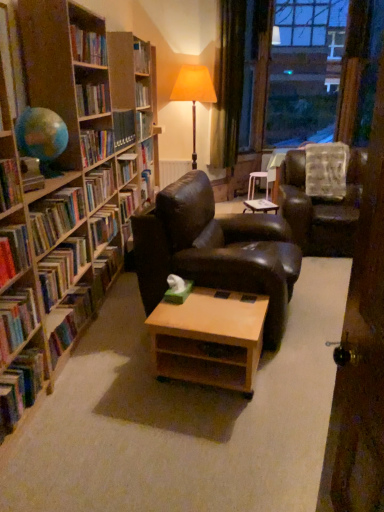
You are a GUI agent. You are given a task and a screenshot of the screen. Output one action in this format:
    pyautogui.click(x=<x>, y=<y>)
    Task: Click on the light brown wood coffee table at center
    This screenshot has height=512, width=384.
    Given the screenshot: What is the action you would take?
    pyautogui.click(x=209, y=339)

You are a GUI agent. You are given a task and a screenshot of the screen. Output one action in this format:
    pyautogui.click(x=<x>, y=<y>)
    Task: Click on the hardcover books at left, which appears as the third book when viewed from the top
    The width and height of the screenshot is (384, 512).
    Given the screenshot: What is the action you would take?
    pyautogui.click(x=55, y=217)

What do you see at coordinates (304, 71) in the screenshot?
I see `transparent glass window at upper right` at bounding box center [304, 71].

Locate an element on the screen. This screenshot has width=384, height=512. transparent glass window at upper right is located at coordinates (304, 71).

Identify the location of hardcover book at left, the seventh book positioned from the top. (69, 320).

Describe the element at coordinates (260, 205) in the screenshot. The height and width of the screenshot is (512, 384). I see `wooden table at center` at that location.

Measure the distance between point (374, 304) and camera.

A distance of 3.59 feet exists between point (374, 304) and camera.

The height and width of the screenshot is (512, 384). What are the coordinates of `light brown wood coffee table at center` in the screenshot? It's located at (209, 339).

In order to click on table lamp above the hardcover book at left, the fourth book positioned from the top (from a real-world perspective) in this screenshot , I will do `click(194, 94)`.

Considering the relative sizes of orange fabric lampshade at center and hardcover book at left, the fifth book when ordered from bottom to top, in the image provided, is orange fabric lampshade at center thinner than hardcover book at left, the fifth book when ordered from bottom to top,?

In fact, orange fabric lampshade at center might be wider than hardcover book at left, the fifth book when ordered from bottom to top.

Considering the relative positions of hardcover book at left, which is counted as the sixth book, starting from the top, and wooden door at right in the image provided, is hardcover book at left, which is counted as the sixth book, starting from the top, to the left of wooden door at right from the viewer's perspective?

Correct, you'll find hardcover book at left, which is counted as the sixth book, starting from the top, to the left of wooden door at right.

From a real-world perspective, is hardcover book at left, arranged as the third book when ordered from the bottom, above or below wooden door at right?

hardcover book at left, arranged as the third book when ordered from the bottom, is below wooden door at right.

Is hardcover book at left, arranged as the third book when ordered from the bottom, further to camera compared to wooden door at right?

Yes, it is behind wooden door at right.

Is hardcover book at left, arranged as the third book when ordered from the bottom, facing towards wooden door at right?

Yes, hardcover book at left, arranged as the third book when ordered from the bottom, is oriented towards wooden door at right.

Looking at this image, can we say hardcover book at left, the seventh book positioned from the top, lies outside wooden bookshelf at left, the 1th book when ordered from top to bottom?

Actually, hardcover book at left, the seventh book positioned from the top, is at least partially inside wooden bookshelf at left, the 1th book when ordered from top to bottom.

Considering their positions, is hardcover book at left, which is the 2th book in bottom-to-top order, located in front of or behind wooden bookshelf at left, the 1th book when ordered from top to bottom?

Clearly, hardcover book at left, which is the 2th book in bottom-to-top order, is behind wooden bookshelf at left, the 1th book when ordered from top to bottom.

From a real-world perspective, which object stands above the other?

wooden bookshelf at left, the 1th book when ordered from top to bottom, is physically above.

How far apart are hardcover book at left, which is the 2th book in bottom-to-top order, and wooden bookshelf at left, the eighth book when ordered from bottom to top?

hardcover book at left, which is the 2th book in bottom-to-top order, and wooden bookshelf at left, the eighth book when ordered from bottom to top, are 22.26 inches apart from each other.

Is hardcover books at left, the sixth book when ordered from bottom to top, in front of or behind light brown wood coffee table at center in the image?

hardcover books at left, the sixth book when ordered from bottom to top, is in front of light brown wood coffee table at center.

Considering the sizes of objects hardcover books at left, the sixth book when ordered from bottom to top, and light brown wood coffee table at center in the image provided, who is wider, hardcover books at left, the sixth book when ordered from bottom to top, or light brown wood coffee table at center?

Wider between the two is light brown wood coffee table at center.

From a real-world perspective, is hardcover books at left, which appears as the third book when viewed from the top, positioned under light brown wood coffee table at center based on gravity?

No, from a real-world perspective, hardcover books at left, which appears as the third book when viewed from the top, is not below light brown wood coffee table at center.

From a real-world perspective, count 5th books upward from the light brown wood coffee table at center and point to it. Please provide its 2D coordinates.

[(55, 217)]

From the image's perspective, which one is positioned higher, hardcover books at left, which appears as the third book when viewed from the top, or wooden table at center?

wooden table at center, from the image's perspective.

Which of these two, hardcover books at left, which appears as the third book when viewed from the top, or wooden table at center, is smaller?

wooden table at center.

Relative to wooden table at center, is hardcover books at left, the sixth book when ordered from bottom to top, in front or behind?

hardcover books at left, the sixth book when ordered from bottom to top, is positioned closer to the viewer than wooden table at center.

Considering the relative sizes of hardcover books at left, the sixth book when ordered from bottom to top, and wooden table at center in the image provided, is hardcover books at left, the sixth book when ordered from bottom to top, wider than wooden table at center?

No, hardcover books at left, the sixth book when ordered from bottom to top, is not wider than wooden table at center.

In the scene shown: Which point is more distant from viewer, (186, 92) or (252, 185)?

The point (252, 185) is farther from the camera.

From a real-world perspective, does orange fabric lampshade at center stand above white plastic stool at center?

Correct, in the physical world, orange fabric lampshade at center is higher than white plastic stool at center.

Is there a large distance between orange fabric lampshade at center and white plastic stool at center?

Yes, orange fabric lampshade at center and white plastic stool at center are located far from each other.

From the image's perspective, which one is positioned lower, orange fabric lampshade at center or white plastic stool at center?

white plastic stool at center appears lower in the image.

Is hardcover books at left, the sixth book when ordered from bottom to top, a part of hardcover books at left, marked as the 4th book in a bottom-to-top arrangement?

No, hardcover books at left, marked as the 4th book in a bottom-to-top arrangement, does not contain hardcover books at left, the sixth book when ordered from bottom to top.

From the picture: Considering the sizes of hardcover books at left, marked as the 4th book in a bottom-to-top arrangement, and hardcover books at left, the sixth book when ordered from bottom to top, in the image, is hardcover books at left, marked as the 4th book in a bottom-to-top arrangement, taller or shorter than hardcover books at left, the sixth book when ordered from bottom to top,?

In the image, hardcover books at left, marked as the 4th book in a bottom-to-top arrangement, appears to be taller than hardcover books at left, the sixth book when ordered from bottom to top.

From the image's perspective, is hardcover books at left, marked as the 5th book in a top-to-bottom arrangement, positioned above or below hardcover books at left, the sixth book when ordered from bottom to top?

Clearly, from the image's perspective, hardcover books at left, marked as the 5th book in a top-to-bottom arrangement, is below hardcover books at left, the sixth book when ordered from bottom to top.

Is hardcover books at left, marked as the 4th book in a bottom-to-top arrangement, bigger or smaller than hardcover books at left, the sixth book when ordered from bottom to top?

Clearly, hardcover books at left, marked as the 4th book in a bottom-to-top arrangement, is larger in size than hardcover books at left, the sixth book when ordered from bottom to top.

Image resolution: width=384 pixels, height=512 pixels. Find the location of `table lamp behind the hardcover book at left, the fifth book when ordered from bottom to top`. table lamp behind the hardcover book at left, the fifth book when ordered from bottom to top is located at coordinates (194, 94).

Locate an element on the screen. The image size is (384, 512). door lying above the hardcover book at left, arranged as the third book when ordered from the bottom (from the image's perspective) is located at coordinates (361, 352).

When comparing their distances from orange fabric lampshade at center, does hardcover book at left, arranged as the third book when ordered from the bottom, or white plastic stool at center seem further?

hardcover book at left, arranged as the third book when ordered from the bottom, is positioned further to the anchor orange fabric lampshade at center.

Based on their spatial positions, is green velvet curtain at upper right or wooden bookshelf at left, the eighth book when ordered from bottom to top, closer to wooden table at center?

green velvet curtain at upper right is closer to wooden table at center.

Considering their positions, is hardcover books at left, the sixth book when ordered from bottom to top, positioned further to hardcover book at left, which is the 2th book in bottom-to-top order, than hardcover book at left, which is counted as the 7th book, starting from the bottom?

Among the two, hardcover book at left, which is counted as the 7th book, starting from the bottom, is located further to hardcover book at left, which is the 2th book in bottom-to-top order.

Which object lies further to the anchor point transparent glass window at upper right, orange fabric lampshade at center or hardcover book at left, which is counted as the sixth book, starting from the top?

Based on the image, hardcover book at left, which is counted as the sixth book, starting from the top, appears to be further to transparent glass window at upper right.

Based on their spatial positions, is white plastic stool at center or hardcover book at left, the fourth book positioned from the top, closer to hardcover book at left, which is the 2th book in bottom-to-top order?

Among the two, hardcover book at left, the fourth book positioned from the top, is located nearer to hardcover book at left, which is the 2th book in bottom-to-top order.

Consider the image. Based on their spatial positions, is hardcover books at left, the sixth book when ordered from bottom to top, or transparent glass window at upper right closer to wooden door at right?

hardcover books at left, the sixth book when ordered from bottom to top, is positioned closer to the anchor wooden door at right.

Based on their spatial positions, is hardcover book at left, the second book viewed from the top, or velvet brown armchair at right, the 2th chair positioned from the left, further from transparent glass window at upper right?

hardcover book at left, the second book viewed from the top, lies further to transparent glass window at upper right than the other object.

Estimate the real-world distances between objects in this image. Which object is further from hardcover book at left, the seventh book positioned from the top, hardcover books at left, which appears as the third book when viewed from the top, or green velvet curtain at upper right?

Among the two, green velvet curtain at upper right is located further to hardcover book at left, the seventh book positioned from the top.

This screenshot has width=384, height=512. What are the coordinates of `table between hardcover books at left, the sixth book when ordered from bottom to top, and white plastic stool at center from front to back` in the screenshot? It's located at (260, 205).

The image size is (384, 512). Find the location of `table lamp located between leather armchair at center, acting as the 2th chair starting from the back, and transparent glass window at upper right in the depth direction`. table lamp located between leather armchair at center, acting as the 2th chair starting from the back, and transparent glass window at upper right in the depth direction is located at coordinates (194, 94).

Locate an element on the screen. This screenshot has height=512, width=384. chair between green velvet curtain at upper right and wooden table at center in the up-down direction is located at coordinates (321, 207).

The width and height of the screenshot is (384, 512). Identify the location of coffee table between hardcover books at left, the sixth book when ordered from bottom to top, and velvet brown armchair at right, the 2th chair positioned from the left, from left to right. (209, 339).